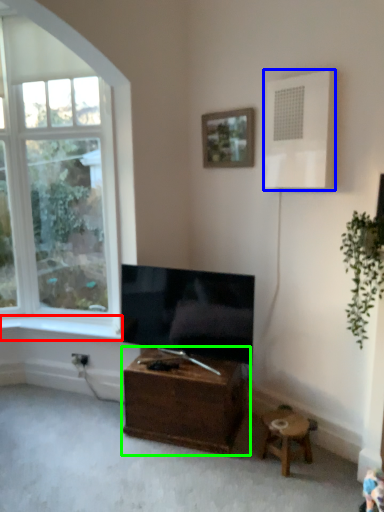
Question: Estimate the real-world distances between objects in this image. Which object is farther from window sill (highlighted by a red box), air conditioner (highlighted by a blue box) or table (highlighted by a green box)?

Choices:
 (A) air conditioner
 (B) table

Answer: (A)